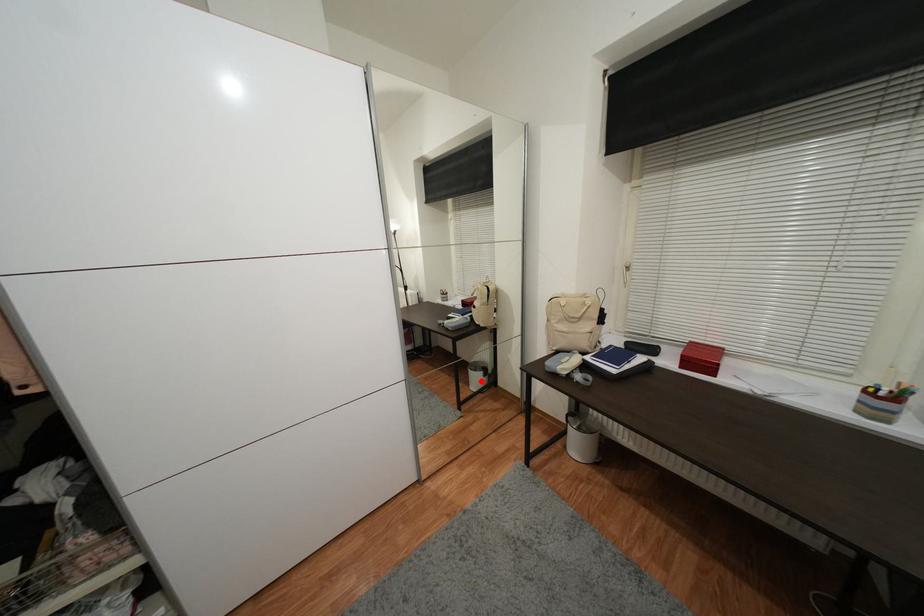
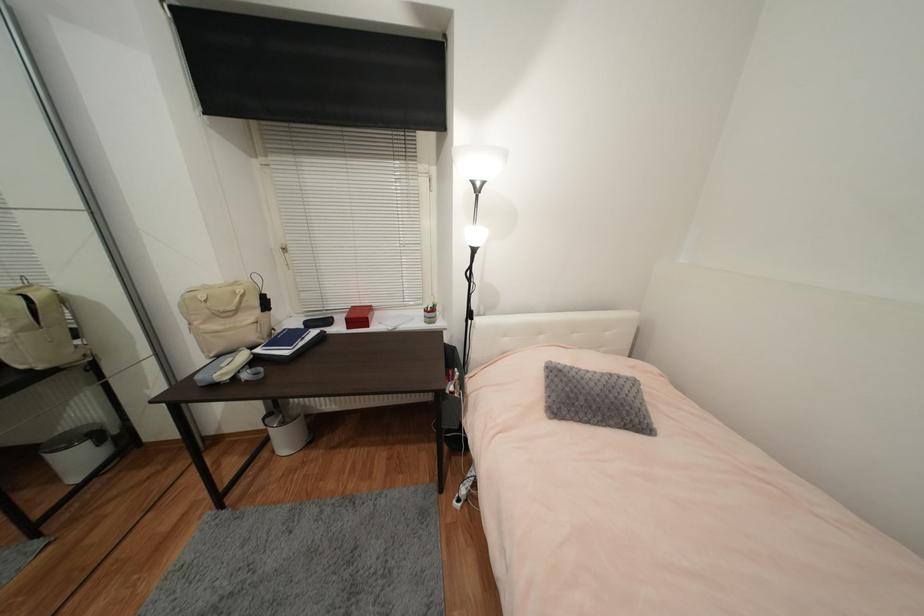
The point at the highlighted location is marked in the first image. Where is the corresponding point in the second image?

(83, 462)